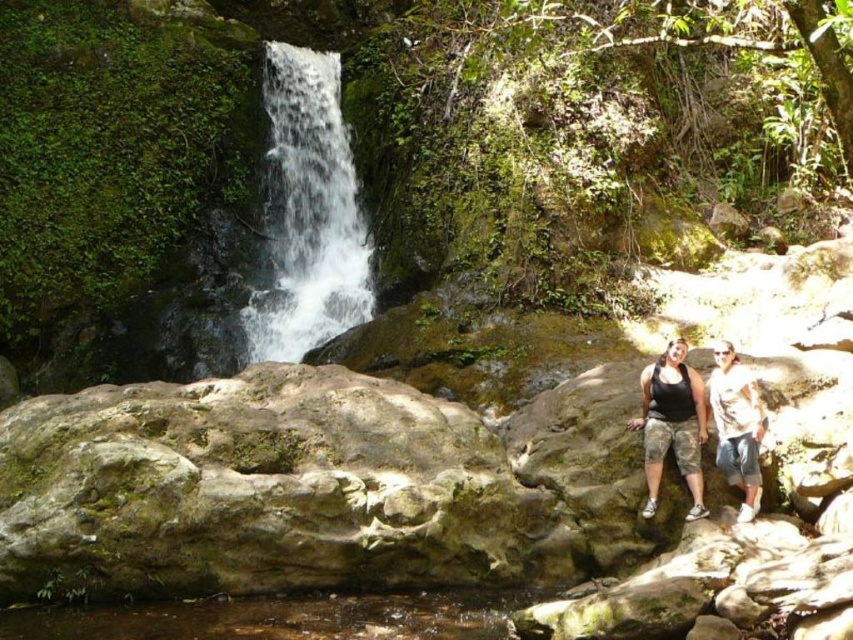
Can you confirm if camouflage pants at lower right is thinner than matte black tank top at lower right?

No, camouflage pants at lower right is not thinner than matte black tank top at lower right.

Based on the photo, which is more to the left, camouflage pants at lower right or matte black tank top at lower right?

Positioned to the left is camouflage pants at lower right.

Which is in front, point (747, 484) or point (729, 420)?

Point (747, 484)

Find the location of a particular element. This screenshot has height=640, width=853. camouflage pants at lower right is located at coordinates point(732,420).

From the picture: Does white frothy water at center have a greater width compared to camouflage pants at lower right?

Indeed, white frothy water at center has a greater width compared to camouflage pants at lower right.

Who is taller, white frothy water at center or camouflage pants at lower right?

Standing taller between the two is white frothy water at center.

Is point (289, 157) more distant than point (677, 433)?

That is True.

Locate an element on the screen. This screenshot has width=853, height=640. white frothy water at center is located at coordinates (308, 212).

Consider the image. Is brown sedimentary rock at lower center above camouflage pants at lower right?

Incorrect, brown sedimentary rock at lower center is not positioned above camouflage pants at lower right.

Locate an element on the screen. The height and width of the screenshot is (640, 853). brown sedimentary rock at lower center is located at coordinates (280, 618).